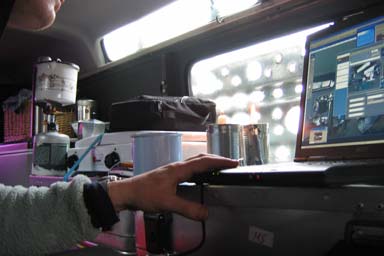
This screenshot has width=384, height=256. I want to click on game on screen, so click(x=337, y=105).